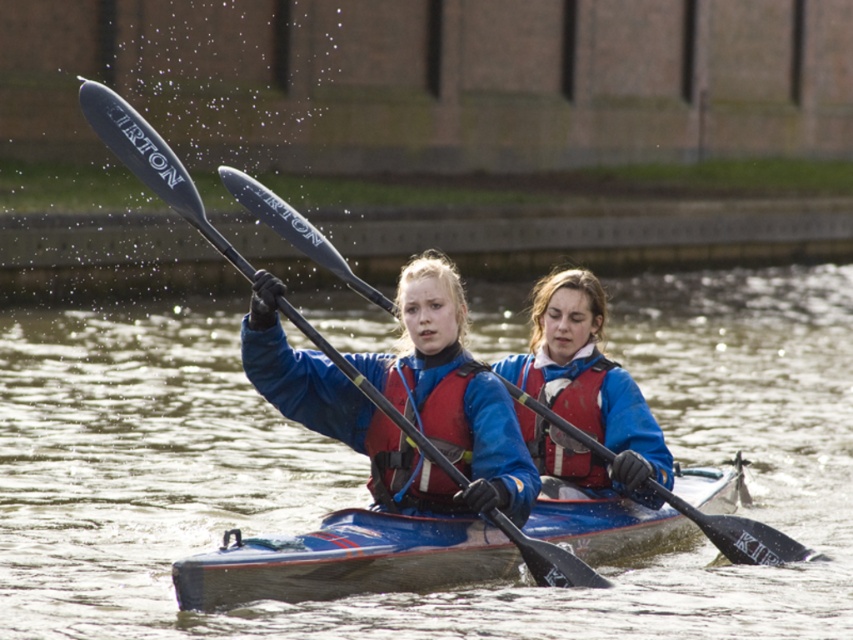
Between point (553, 614) and point (415, 410), which one is positioned behind?

Point (553, 614)

Who is taller, clear water at center or red fabric life jacket at center?

With more height is clear water at center.

Is point (306, 300) in front of point (397, 369)?

No.

This screenshot has height=640, width=853. What are the coordinates of `clear water at center` in the screenshot? It's located at (367, 468).

Who is positioned more to the left, blue glossy kayak at center or red fabric life jacket at center?

red fabric life jacket at center is more to the left.

Who is higher up, blue glossy kayak at center or red fabric life jacket at center?

red fabric life jacket at center is higher up.

Locate an element on the screen. This screenshot has width=853, height=640. blue glossy kayak at center is located at coordinates (345, 560).

Does matte blue kayak at center appear over red matte life jacket at center?

Incorrect, matte blue kayak at center is not positioned above red matte life jacket at center.

Identify the location of matte blue kayak at center. (462, 396).

Where is `matte blue kayak at center`? The width and height of the screenshot is (853, 640). matte blue kayak at center is located at coordinates (462, 396).